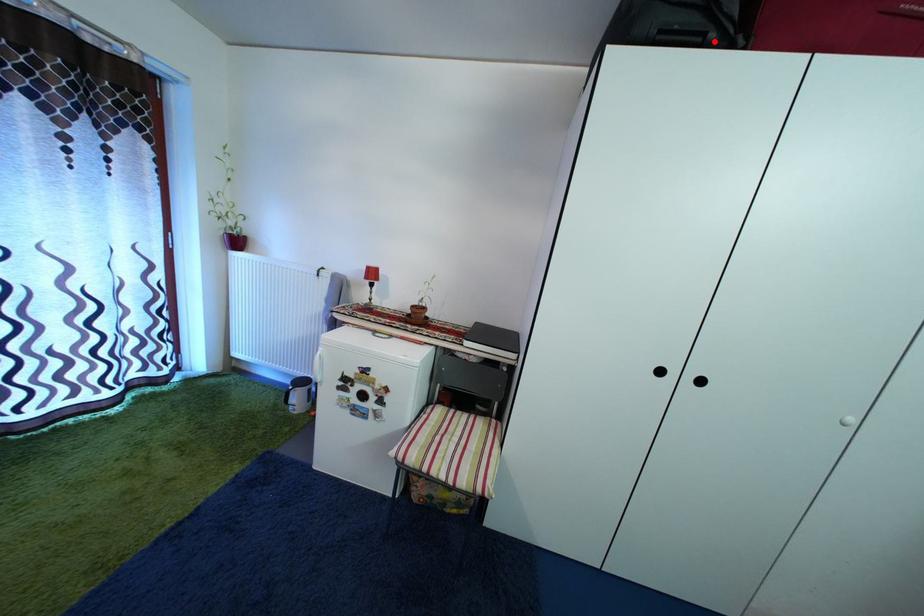
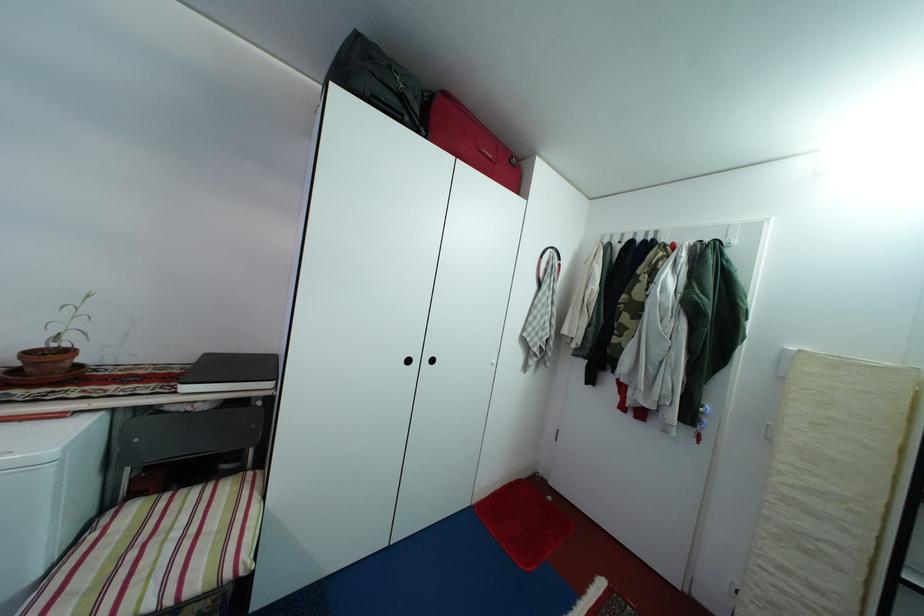
Where in the second image is the point corresponding to the highlighted location from the first image?

(410, 123)